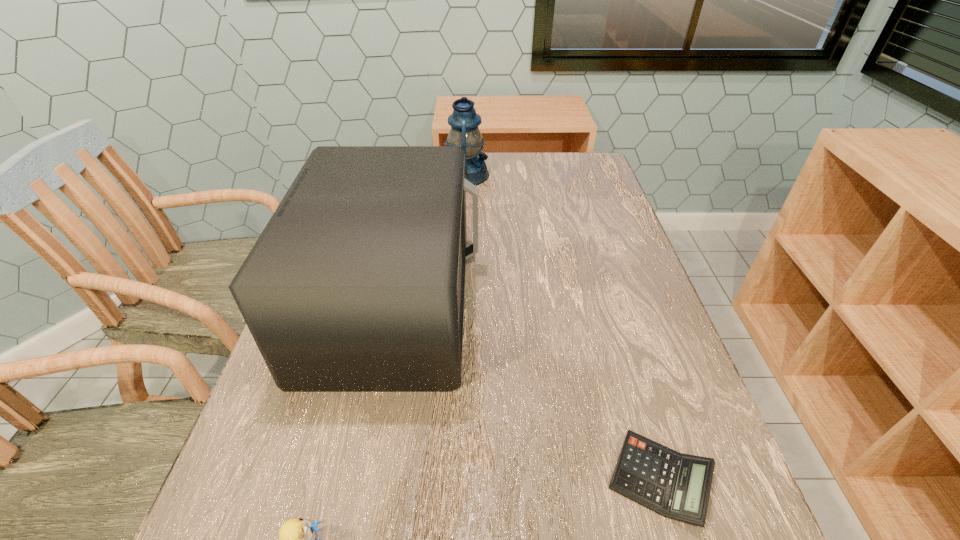
Identify the location of free region at the far edge. (516, 181).

Where is `free space at the left edge of the desktop`? free space at the left edge of the desktop is located at coordinates (326, 498).

This screenshot has height=540, width=960. In the image, there is a desktop. What are the coordinates of `free space at the right edge` in the screenshot? It's located at (607, 202).

This screenshot has height=540, width=960. Identify the location of free space at the far right corner of the desktop. (550, 162).

Find the location of a particular element. This screenshot has height=540, width=960. vacant area between the lantern and the shortest object is located at coordinates (563, 327).

Where is `free spot between the rightmost object and the second farthest object`? This screenshot has width=960, height=540. free spot between the rightmost object and the second farthest object is located at coordinates (526, 392).

Where is `free point between the third nearest object and the calculator`? This screenshot has height=540, width=960. free point between the third nearest object and the calculator is located at coordinates (526, 392).

I want to click on vacant space in between the lantern and the shortest object, so click(x=563, y=327).

Locate an element on the screen. empty location between the microwave oven and the calculator is located at coordinates (526, 392).

You are a GUI agent. You are given a task and a screenshot of the screen. Output one action in this format:
    pyautogui.click(x=<x>, y=<y>)
    Task: Click on the object that is the third nearest to the third tallest object
    This screenshot has height=540, width=960.
    Given the screenshot: What is the action you would take?
    pyautogui.click(x=464, y=133)